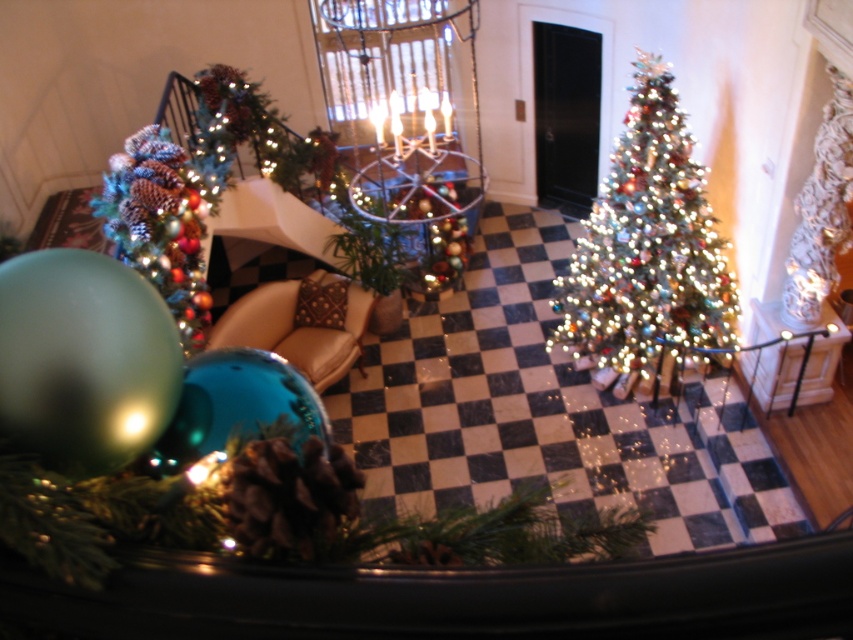
Question: Observing the image, what is the correct spatial positioning of shiny glass ornament at center in reference to shiny metallic ornament at left?

Choices:
 (A) above
 (B) below

Answer: (B)

Question: Which point is farther from the camera taking this photo?

Choices:
 (A) (387, 540)
 (B) (189, 212)
 (C) (585, 228)

Answer: (C)

Question: Can you confirm if shiny glass ornament at center is positioned to the left of shiny metallic ornament at left?

Choices:
 (A) no
 (B) yes

Answer: (A)

Question: Which object appears closest to the camera in this image?

Choices:
 (A) iridescent glass christmas tree at center
 (B) shiny glass ornament at center

Answer: (B)

Question: Based on their relative distances, which object is nearer to the shiny metallic ornament at left?

Choices:
 (A) iridescent glass christmas tree at center
 (B) shiny glass ornament at center

Answer: (A)

Question: Is iridescent glass christmas tree at center above shiny metallic ornament at left?

Choices:
 (A) no
 (B) yes

Answer: (B)